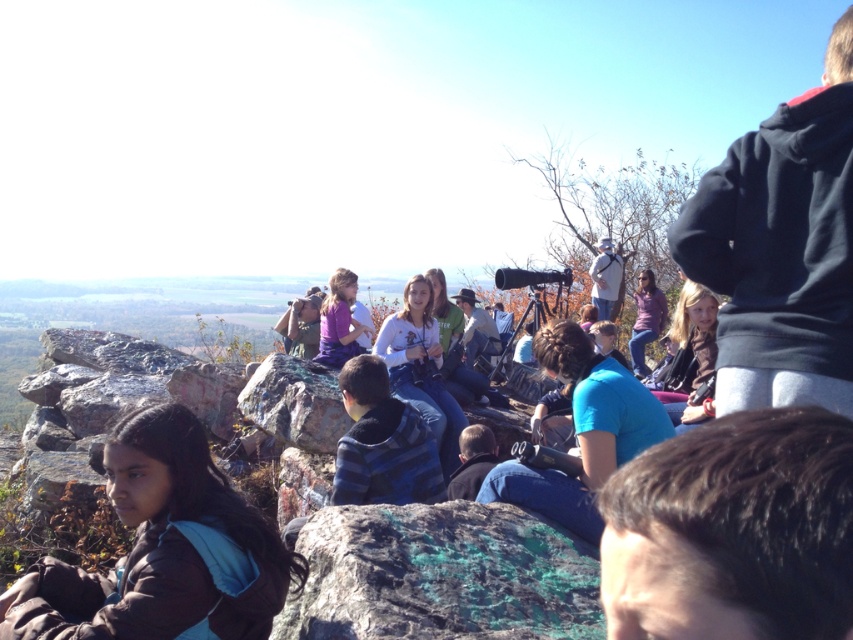
You are planning to place a small picnic basket on the surface between the green marbled rock at center and the matte purple shirt at center. Based on the space available, will the basket fit comfortably without overlapping either object?

The green marbled rock at center might be wider than matte purple shirt at center, so there may not be enough space to place the picnic basket comfortably between them without overlapping one of the objects.

You are standing at the edge of the rocky outcrop and want to place a small picnic basket on the green marbled rock at center. Based on the coordinates provided, is the rock located in the upper or lower half of the image?

The green marbled rock at center is located at coordinates point (440, 576). Since the y coordinate is 0.518, which is just above the halfway point of the image, it is in the upper half of the image.

You are standing at the scenic overlook and notice both the green marbled rock at center and the matte purple shirt at center. Which object is located to the right when facing the scene?

The green marbled rock at center is positioned to the right of the matte purple shirt at center.